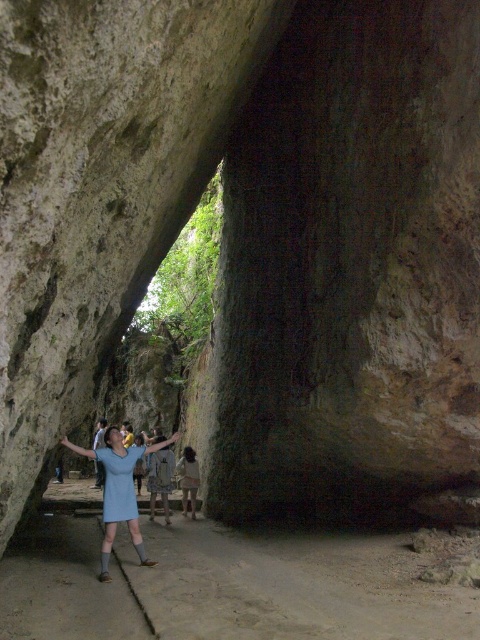
In the scene shown: You are standing inside the cave and want to take a photo of the light brown fabric dress at center. Based on its position, where should you aim your camera to capture it in the frame?

The light brown fabric dress at center is located at point 0.750 on the horizontal axis and 0.394 on the vertical axis, so you should aim your camera towards the lower right area of the cave to capture it in the frame.

You are a photographer inside the cave and want to capture both the light blue fabric dress at center and the blue dress at center in the same frame. Which dress is closer to you, the photographer?

The light blue fabric dress at center is positioned over blue dress at center, so the light blue fabric dress at center is closer to you.